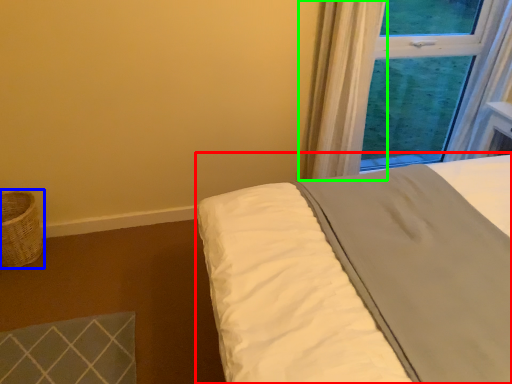
Question: Which object is positioned farthest from bed (highlighted by a red box)? Select from basket (highlighted by a blue box) and curtain (highlighted by a green box).

Choices:
 (A) basket
 (B) curtain

Answer: (A)